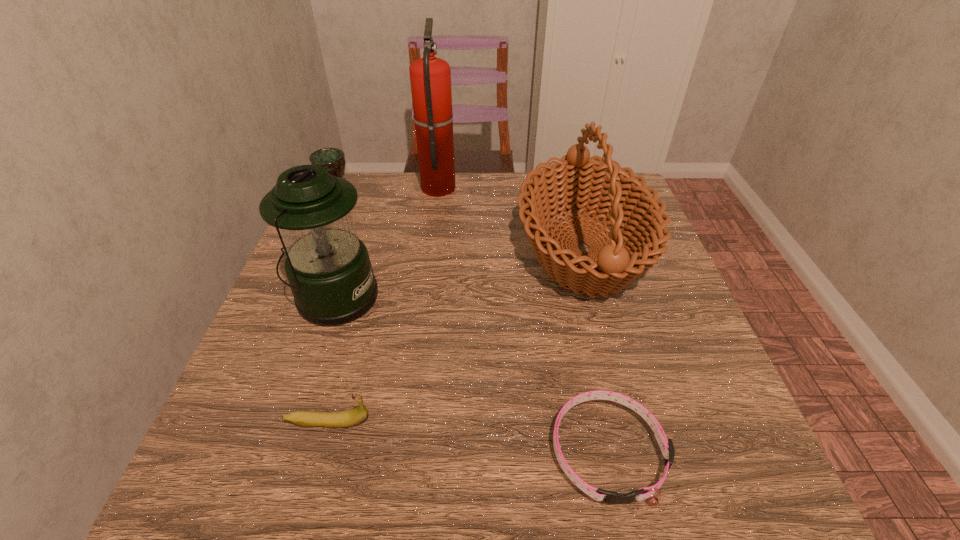
At what (x,y) coordinates should I click in order to perform the action: click on vacant point located 0.190m on the right of the chalice. Please return your answer as a coordinate pair (x, y). This screenshot has height=540, width=960. Looking at the image, I should click on (424, 202).

Where is `free point located 0.100m at the stem of the fifth tallest object`? The height and width of the screenshot is (540, 960). free point located 0.100m at the stem of the fifth tallest object is located at coordinates (432, 422).

Find the location of `fire extinguisher present at the far edge`. fire extinguisher present at the far edge is located at coordinates (430, 77).

Identify the location of basket located in the far edge section of the desktop. The width and height of the screenshot is (960, 540). (574, 183).

Identify the location of chalice situated at the far edge. (328, 158).

Image resolution: width=960 pixels, height=540 pixels. I want to click on object at the near edge, so click(x=666, y=445).

At what (x,y) coordinates should I click in order to perform the action: click on lantern present at the left edge. Please return your answer as a coordinate pair (x, y). This screenshot has width=960, height=540. Looking at the image, I should click on (328, 268).

This screenshot has width=960, height=540. Identify the location of chalice present at the left edge. (328, 158).

The image size is (960, 540). In order to click on banana that is at the left edge in this screenshot , I will do `click(355, 416)`.

At what (x,y) coordinates should I click in order to perform the action: click on basket that is positioned at the right edge. Please return your answer as a coordinate pair (x, y). This screenshot has height=540, width=960. Looking at the image, I should click on (574, 183).